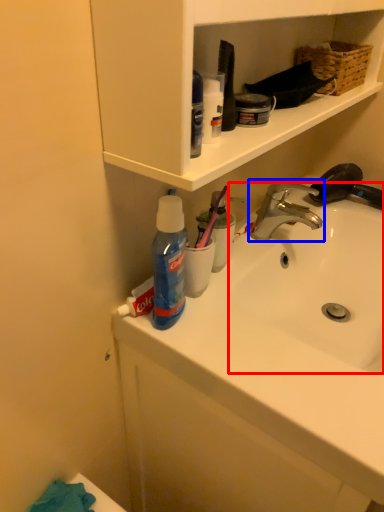
Question: Which object appears farthest to the camera in this image, sink (highlighted by a red box) or tap (highlighted by a blue box)?

Choices:
 (A) sink
 (B) tap

Answer: (B)